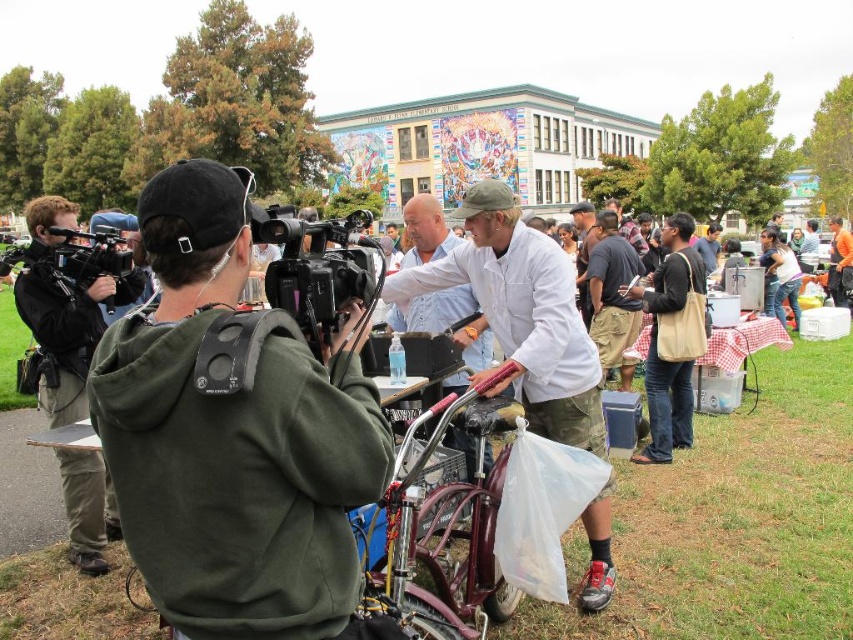
Question: Among these points, which one is farthest from the camera?

Choices:
 (A) (474, 490)
 (B) (311, 308)

Answer: (A)

Question: Is white matte coat at center bigger than black plastic video camera at center?

Choices:
 (A) no
 (B) yes

Answer: (A)

Question: Estimate the real-world distances between objects in this image. Which object is closer to the white matte coat at center?

Choices:
 (A) maroon metallic bicycle at center
 (B) matte black camera at left

Answer: (A)

Question: Is white matte coat at center wider than black plastic video camera at center?

Choices:
 (A) yes
 (B) no

Answer: (A)

Question: Can you confirm if white matte coat at center is positioned to the left of maroon metallic bicycle at center?

Choices:
 (A) yes
 (B) no

Answer: (B)

Question: Among these points, which one is nearest to the camera?

Choices:
 (A) (329, 234)
 (B) (33, 232)

Answer: (A)